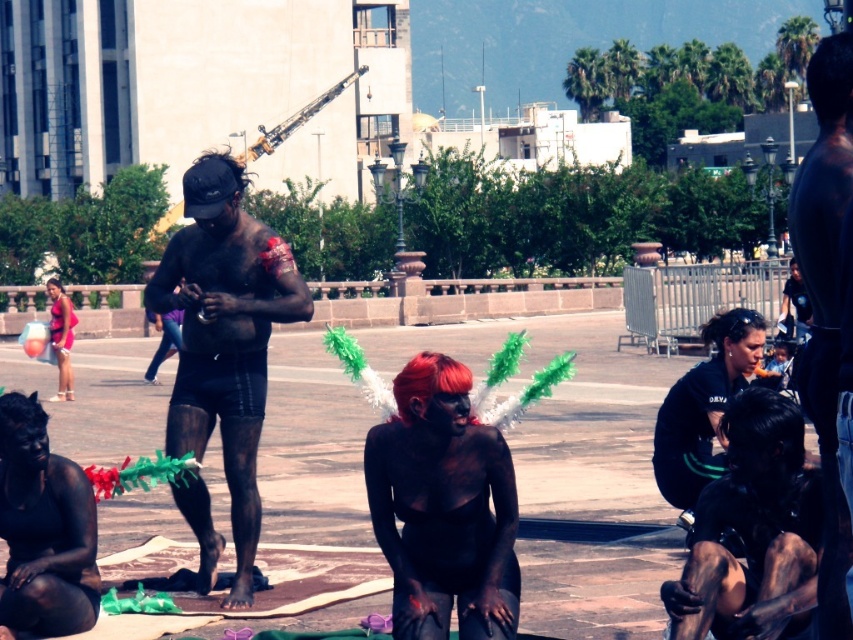
Question: Is black matte body paint at center above black matte body paint at lower left?

Choices:
 (A) no
 (B) yes

Answer: (B)

Question: Which object appears farthest from the camera in this image?

Choices:
 (A) black matte shorts at center
 (B) black matte uniform at center
 (C) black matte body paint at center

Answer: (B)

Question: Estimate the real-world distances between objects in this image. Which object is closer to the black matte body paint at lower left?

Choices:
 (A) black matte uniform at center
 (B) black matte shorts at center
 (C) black matte body paint at center

Answer: (B)

Question: Does black matte body paint at center lie in front of black matte body paint at lower left?

Choices:
 (A) yes
 (B) no

Answer: (A)

Question: Which is nearer to the black matte uniform at center?

Choices:
 (A) black matte body paint at lower left
 (B) black matte body paint at center

Answer: (B)

Question: Does black matte shorts at center have a lesser width compared to black matte body paint at lower left?

Choices:
 (A) yes
 (B) no

Answer: (B)